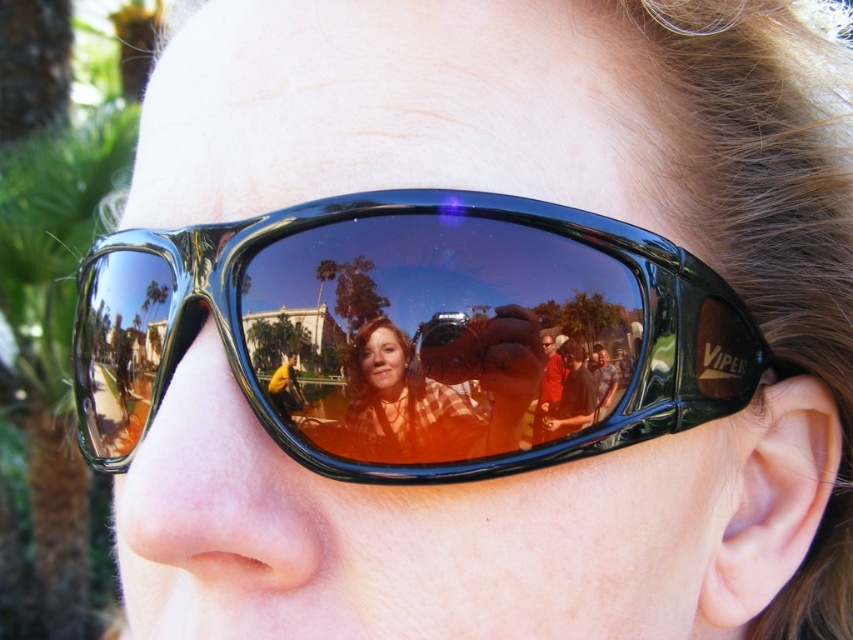
Does shiny black goggles at center have a greater width compared to matte orange sunglasses at center?

Yes, shiny black goggles at center is wider than matte orange sunglasses at center.

The image size is (853, 640). What do you see at coordinates (416, 333) in the screenshot? I see `shiny black goggles at center` at bounding box center [416, 333].

Image resolution: width=853 pixels, height=640 pixels. Identify the location of shiny black goggles at center. (416, 333).